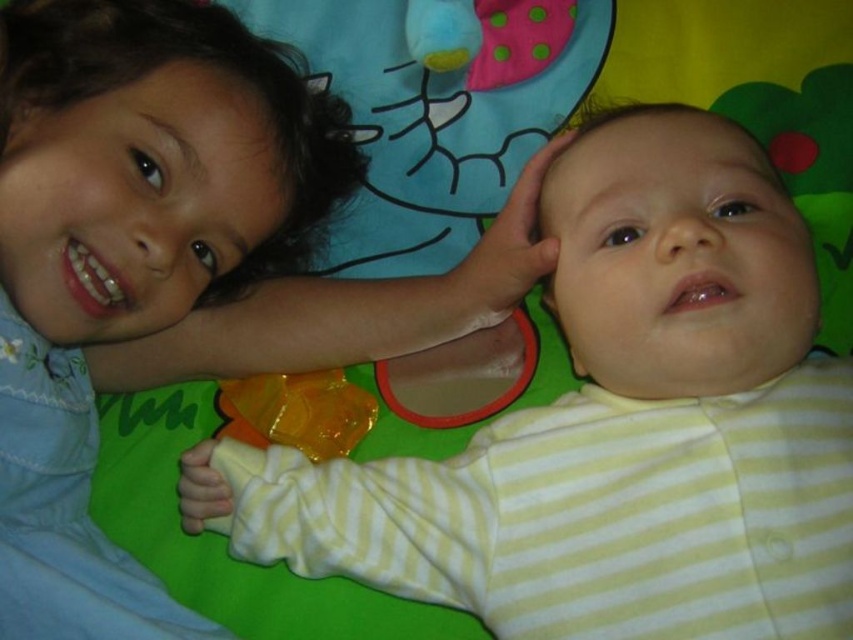
You are a photographer setting up for a family photo. You need to ensure that both the yellow striped onesie at center and the translucent orange pacifier at lower center are visible in the frame. Given their sizes, which object might require you to adjust your camera angle to capture it properly?

The translucent orange pacifier at lower center is smaller than the yellow striped onesie at center, so it might require adjusting the camera angle to ensure it is clearly visible in the photo.

Which object is wider, the matte blue shirt at upper left or the translucent orange pacifier at lower center?

The matte blue shirt at upper left is wider than the translucent orange pacifier at lower center according to the description.

You are a photographer trying to capture the baby in the yellow striped onesie at center. Based on the coordinates provided, where should you focus your camera to ensure the baby is centered in the frame?

The yellow striped onesie at center is located at point coordinates (x=583, y=396), so you should focus your camera at those coordinates to center the baby in the frame.